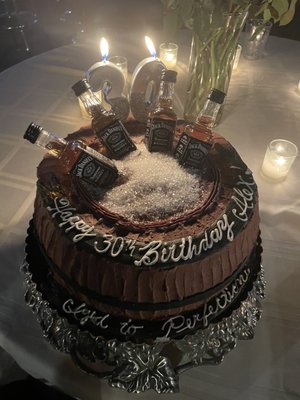
Find the location of a particular element. The width and height of the screenshot is (300, 400). birthday cake is located at coordinates (x=147, y=294).